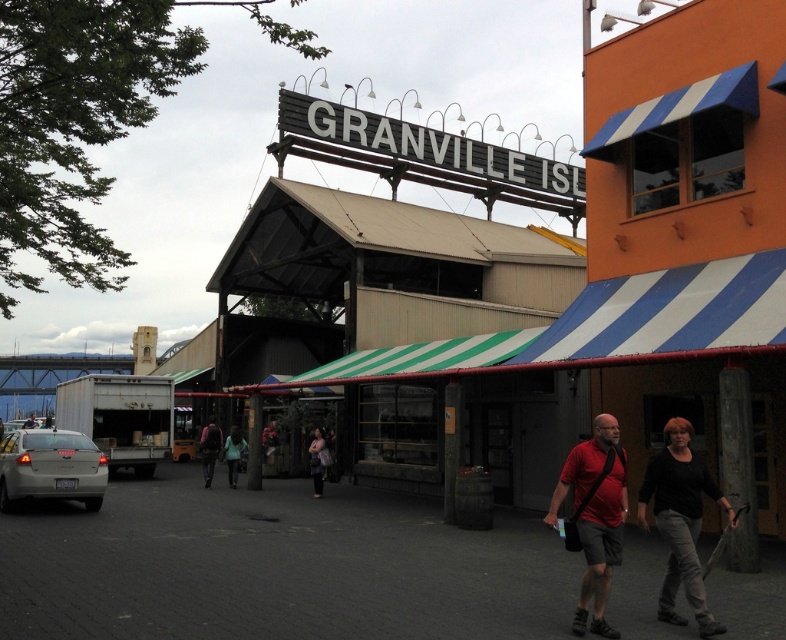
Question: Which point is closer to the camera taking this photo?

Choices:
 (A) (20, 481)
 (B) (237, 472)
 (C) (212, 472)

Answer: (A)

Question: Does satin silver sedan at lower left appear on the left side of light blue fabric jacket at center?

Choices:
 (A) yes
 (B) no

Answer: (A)

Question: Among these objects, which one is farthest from the camera?

Choices:
 (A) matte red shirt at center
 (B) satin silver sedan at lower left
 (C) dark gray fabric jacket at center
 (D) black cotton shirt at center

Answer: (C)

Question: Considering the relative positions of black cotton shirt at center and matte red shirt at center in the image provided, where is black cotton shirt at center located with respect to matte red shirt at center?

Choices:
 (A) above
 (B) below

Answer: (B)

Question: Is matte red shirt at center thinner than satin silver sedan at lower left?

Choices:
 (A) no
 (B) yes

Answer: (B)

Question: Which object is farther from the camera taking this photo?

Choices:
 (A) satin silver sedan at lower left
 (B) black cotton shirt at center
 (C) matte black jacket at center

Answer: (C)